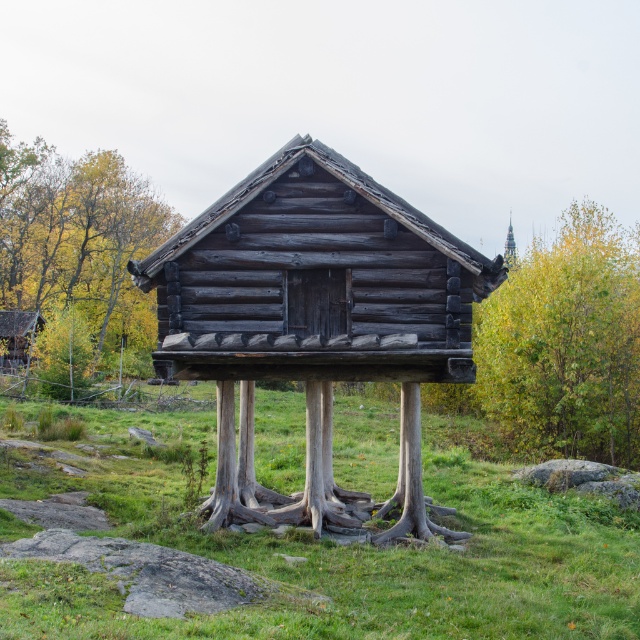
From the picture: Is weathered wood log cabin at center below wooden cabin at center?

No, weathered wood log cabin at center is not below wooden cabin at center.

Between weathered wood log cabin at center and wooden cabin at center, which one has more height?

weathered wood log cabin at center is taller.

Who is more forward, (449, 301) or (10, 333)?

Point (449, 301)

You are a GUI agent. You are given a task and a screenshot of the screen. Output one action in this format:
    pyautogui.click(x=<x>, y=<y>)
    Task: Click on the weathered wood log cabin at center
    
    Given the screenshot: What is the action you would take?
    pyautogui.click(x=314, y=320)

Which is more to the right, weathered wood log cabin at center or green leafy tree at right?

From the viewer's perspective, green leafy tree at right appears more on the right side.

Between point (305, 173) and point (620, 273), which one is positioned in front?

Point (305, 173) is more forward.

What do you see at coordinates (314, 320) in the screenshot? The height and width of the screenshot is (640, 640). I see `weathered wood log cabin at center` at bounding box center [314, 320].

Where is `weathered wood log cabin at center`? weathered wood log cabin at center is located at coordinates (314, 320).

In the scene shown: Does green grass at center have a larger size compared to brown wood tree at left?

Actually, green grass at center might be smaller than brown wood tree at left.

Consider the image. Is green grass at center smaller than brown wood tree at left?

Correct, green grass at center occupies less space than brown wood tree at left.

Locate an element on the screen. green grass at center is located at coordinates (324, 545).